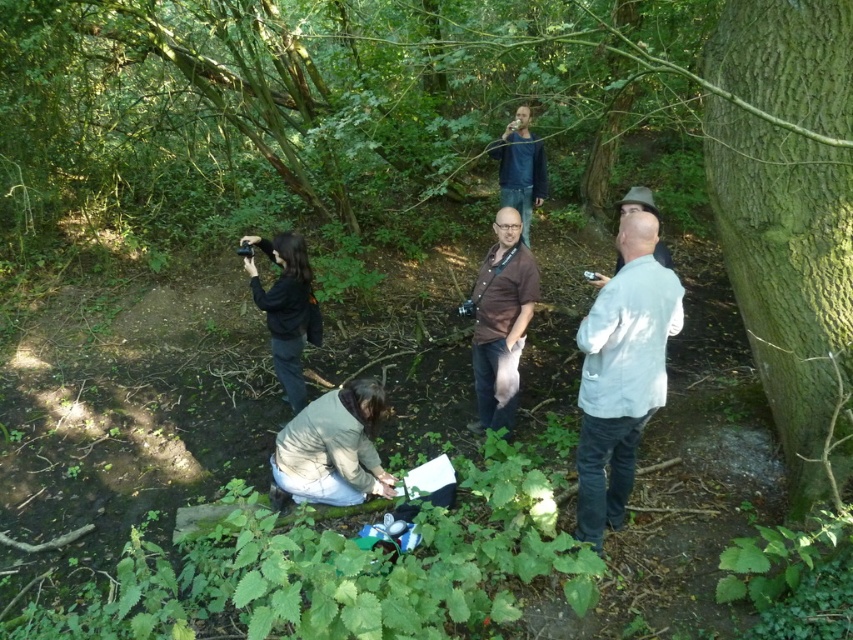
Is point (329, 394) in front of point (596, 273)?

Yes, point (329, 394) is closer to viewer.

Does light beige sweater at lower center have a lesser height compared to white cotton shirt at upper right?

No, light beige sweater at lower center is not shorter than white cotton shirt at upper right.

Does point (386, 476) come farther from viewer compared to point (618, 266)?

No, it is in front of (618, 266).

Where is `light beige sweater at lower center`? light beige sweater at lower center is located at coordinates click(334, 448).

Identify the location of white cotton shirt at right. Image resolution: width=853 pixels, height=640 pixels. (621, 372).

Between white cotton shirt at right and blue denim jeans at upper center, which one has more height?

white cotton shirt at right

Measure the distance between white cotton shirt at right and camera.

white cotton shirt at right and camera are 2.77 meters apart.

Image resolution: width=853 pixels, height=640 pixels. I want to click on white cotton shirt at right, so click(x=621, y=372).

Is light beige sweater at lower center thinner than brown fabric shirt at center?

Incorrect, light beige sweater at lower center's width is not less than brown fabric shirt at center's.

Between point (354, 483) and point (498, 244), which one is positioned behind?

Point (498, 244)

Between point (305, 422) and point (517, 237), which one is positioned behind?

The point (517, 237) is behind.

Where is `light beige sweater at lower center`? light beige sweater at lower center is located at coordinates (334, 448).